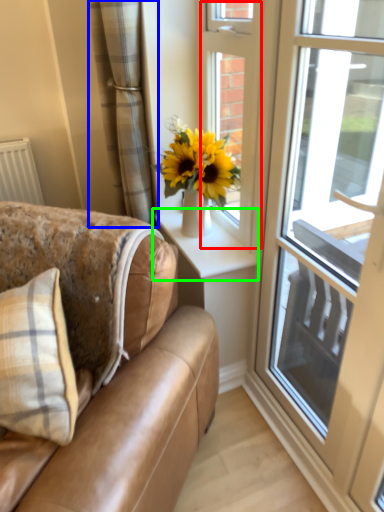
Question: Which object is the closest to the door (highlighted by a red box)? Choose among these: curtain (highlighted by a blue box) or window sill (highlighted by a green box).

Choices:
 (A) curtain
 (B) window sill

Answer: (B)